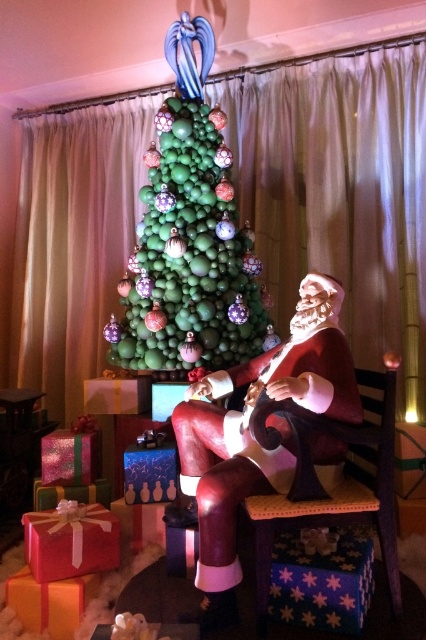
The height and width of the screenshot is (640, 426). Identify the location of matte red santa at center. (250, 435).

Does point (250, 464) come in front of point (359, 426)?

Yes, it is.

This screenshot has height=640, width=426. In order to click on matte red santa at center in this screenshot , I will do `click(250, 435)`.

Between green matte ornaments at center and wooden textured chair at center, which one appears on the left side from the viewer's perspective?

From the viewer's perspective, green matte ornaments at center appears more on the left side.

Is green matte ornaments at center further to the viewer compared to wooden textured chair at center?

Yes.

Between point (166, 99) and point (377, 513), which one is positioned behind?

The point (166, 99) is more distant.

This screenshot has height=640, width=426. Find the location of `green matte ornaments at center`. green matte ornaments at center is located at coordinates (189, 236).

Does wooden textured chair at center appear on the right side of shiny red gift at lower left?

Indeed, wooden textured chair at center is positioned on the right side of shiny red gift at lower left.

Is point (393, 502) more distant than point (78, 513)?

No, (393, 502) is in front of (78, 513).

Is point (262, 612) more distant than point (81, 548)?

No, it is not.

The width and height of the screenshot is (426, 640). Identify the location of wooden textured chair at center. (339, 484).